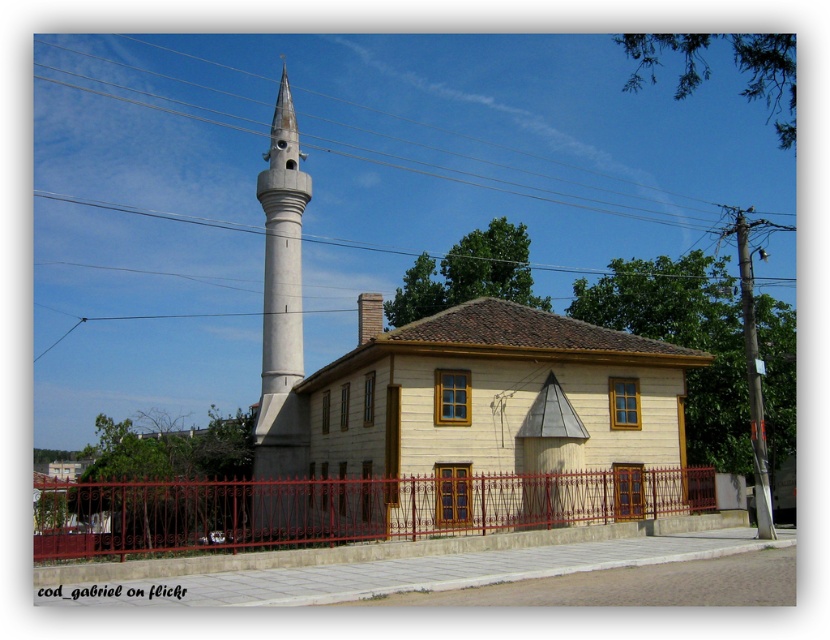
Is metallic wire at upper center taller than white concrete minaret at left?

No.

Can you confirm if metallic wire at upper center is bigger than white concrete minaret at left?

Actually, metallic wire at upper center might be smaller than white concrete minaret at left.

Is point (416, 168) positioned behind point (287, 246)?

That is True.

You are a GUI agent. You are given a task and a screenshot of the screen. Output one action in this format:
    pyautogui.click(x=<x>, y=<y>)
    Task: Click on the metallic wire at upper center
    
    Given the screenshot: What is the action you would take?
    pyautogui.click(x=496, y=164)

Find the location of a particular element. red wrought iron fence at lower center is located at coordinates (345, 509).

This screenshot has width=830, height=640. Identify the location of red wrought iron fence at lower center. (345, 509).

Locate an element on the screen. The width and height of the screenshot is (830, 640). red wrought iron fence at lower center is located at coordinates (345, 509).

Can you confirm if red wrought iron fence at lower center is taller than white concrete minaret at left?

No.

Who is more forward, [38,561] or [296,515]?

Point [38,561]

I want to click on red wrought iron fence at lower center, so (345, 509).